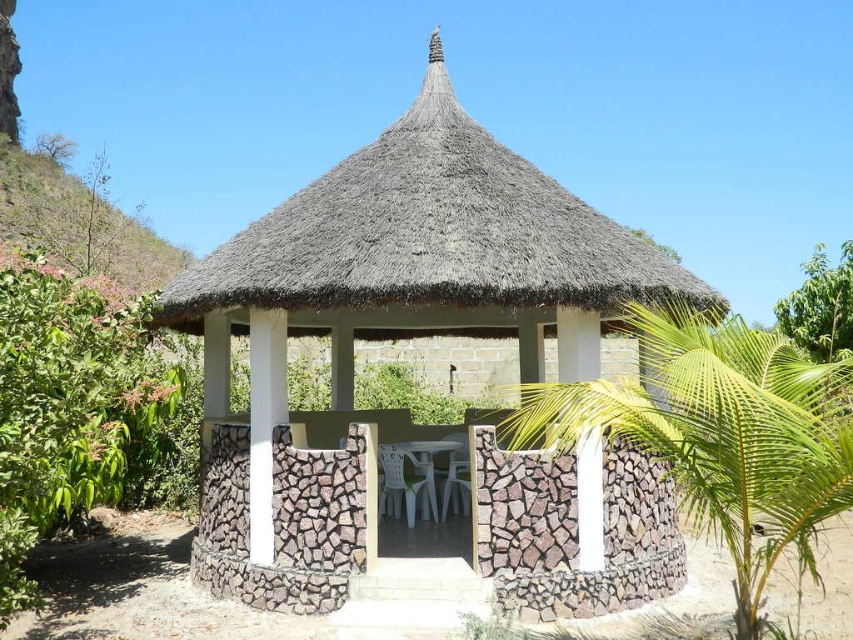
This screenshot has height=640, width=853. What do you see at coordinates (383, 324) in the screenshot?
I see `thatched roof hut at center` at bounding box center [383, 324].

Is thatched roof hut at center shorter than green leafy palm tree at center?

No.

This screenshot has height=640, width=853. I want to click on thatched roof hut at center, so click(383, 324).